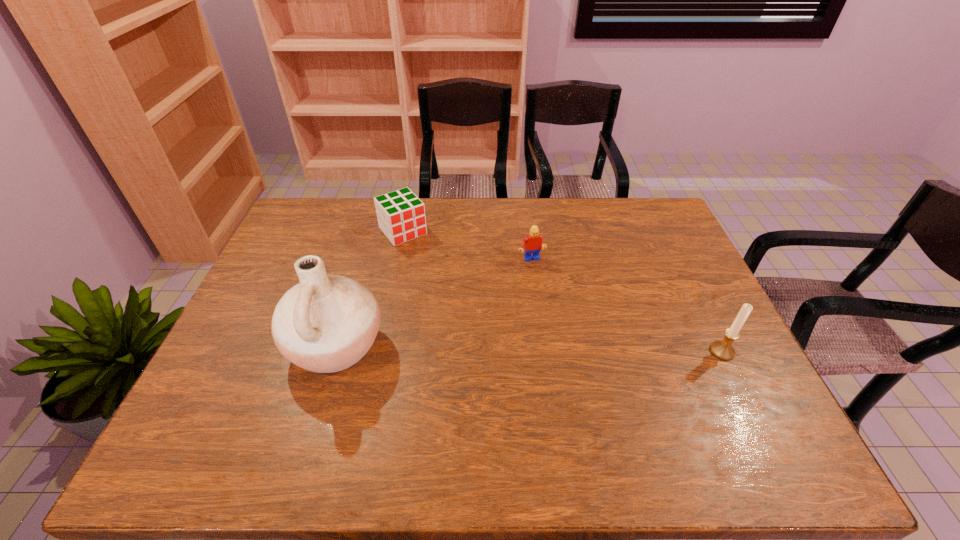
You are a GUI agent. You are given a task and a screenshot of the screen. Output one action in this format:
    pyautogui.click(x=<x>, y=<y>)
    Task: Click on the blank space at the far edge
    This screenshot has height=540, width=960.
    Given the screenshot: What is the action you would take?
    pyautogui.click(x=445, y=226)

I want to click on vacant space at the near edge, so click(636, 418).

You are a GUI agent. You are given a task and a screenshot of the screen. Output one action in this format:
    pyautogui.click(x=<x>, y=<y>)
    Task: Click on the vacant space at the left edge
    
    Given the screenshot: What is the action you would take?
    pyautogui.click(x=290, y=251)

Locate an element on the screen. The width and height of the screenshot is (960, 540). vacant space at the right edge is located at coordinates (698, 306).

This screenshot has width=960, height=540. Identify the location of vacant area at the far left corner of the desktop. (331, 206).

You are a GUI agent. You are given a task and a screenshot of the screen. Output one action in this format:
    pyautogui.click(x=<x>, y=<y>)
    Task: Click on the vacant point at the far right corner
    This screenshot has width=960, height=540.
    Given the screenshot: What is the action you would take?
    pyautogui.click(x=667, y=215)

Identify the location of vacant point located between the farthest object and the third object from left to right. (467, 245).

The image size is (960, 540). What are the coordinates of `vacant space that is in between the tallest object and the third shortest object` in the screenshot? It's located at (529, 349).

The width and height of the screenshot is (960, 540). I want to click on empty space between the rightmost object and the second farthest object, so click(627, 306).

Identify the location of blank region between the pottery and the second tallest object. This screenshot has height=540, width=960. (529, 349).